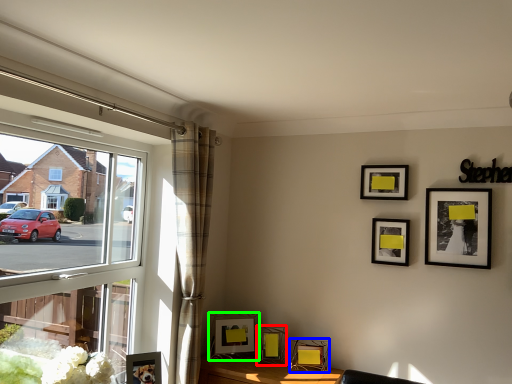
Question: Which object is positioned farthest from picture frame (highlighted by a red box)? Select from picture frame (highlighted by a blue box) and picture frame (highlighted by a green box).

Choices:
 (A) picture frame
 (B) picture frame

Answer: (A)